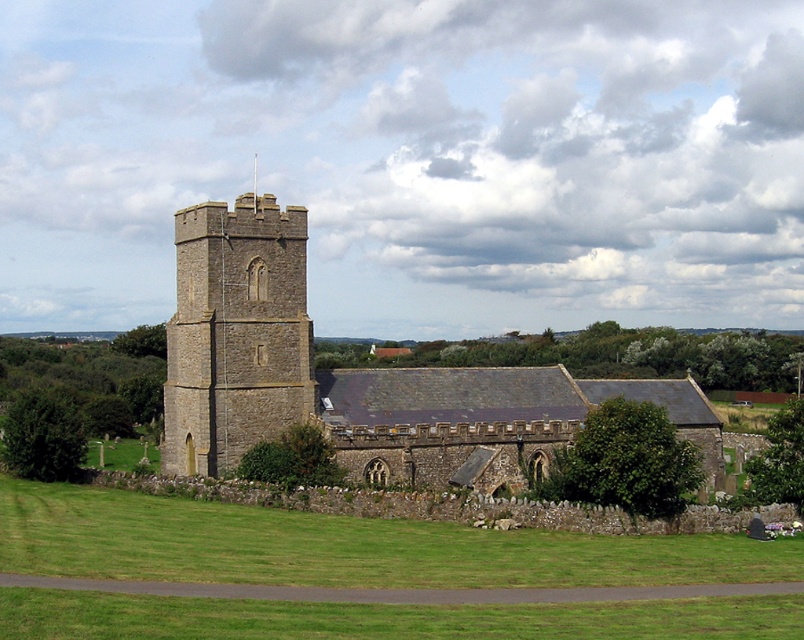
Question: Is brown stone church at center wider than stone tower at center?

Choices:
 (A) yes
 (B) no

Answer: (A)

Question: Which of the following is the closest to the observer?

Choices:
 (A) brown stone church at center
 (B) stone tower at center
 (C) green grass at lower center

Answer: (C)

Question: Is green grass at lower center wider than brown stone church at center?

Choices:
 (A) yes
 (B) no

Answer: (A)

Question: Among these objects, which one is nearest to the camera?

Choices:
 (A) brown stone church at center
 (B) stone tower at center
 (C) green grass at lower center

Answer: (C)

Question: Among these points, which one is farthest from the camera?

Choices:
 (A) (359, 435)
 (B) (247, 321)
 (C) (725, 550)

Answer: (B)

Question: In this image, where is green grass at lower center located relative to stone tower at center?

Choices:
 (A) left
 (B) right

Answer: (B)